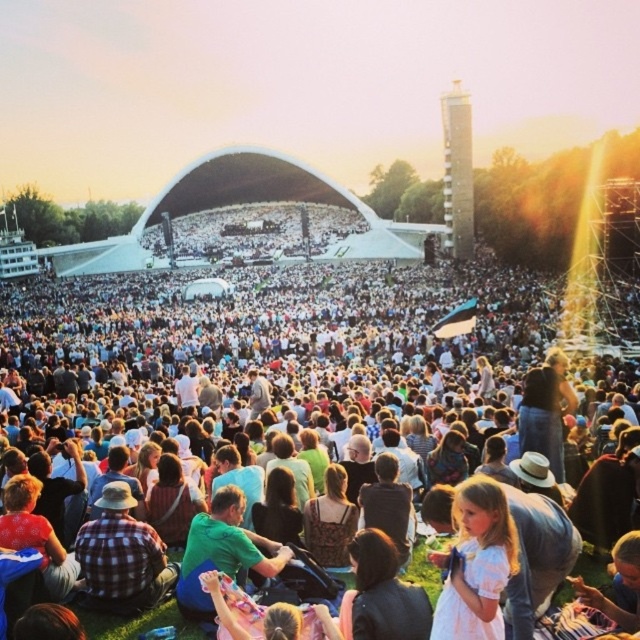
Does matte white tent at upper center have a greater height compared to denim jacket at lower right?

Correct, matte white tent at upper center is much taller as denim jacket at lower right.

Can you confirm if matte white tent at upper center is bigger than denim jacket at lower right?

Indeed, matte white tent at upper center has a larger size compared to denim jacket at lower right.

Is point (467, 269) less distant than point (570, 404)?

No, (467, 269) is behind (570, 404).

Locate an element on the screen. Image resolution: width=640 pixels, height=640 pixels. matte white tent at upper center is located at coordinates (259, 353).

Is point (83, 560) farther from viewer compared to point (572, 412)?

That is False.

Which is in front, point (115, 580) or point (552, 362)?

Point (115, 580)

Locate an element on the screen. The image size is (640, 640). plaid fabric shirt at center is located at coordinates (122, 557).

Does white cotton dress at center appear on the right side of plaid fabric shirt at center?

Yes, white cotton dress at center is to the right of plaid fabric shirt at center.

Between white cotton dress at center and plaid fabric shirt at center, which one appears on the right side from the viewer's perspective?

white cotton dress at center is more to the right.

Who is more distant from viewer, (488, 515) or (131, 500)?

The point (131, 500) is behind.

Find the location of a particular element. The width and height of the screenshot is (640, 640). white cotton dress at center is located at coordinates (476, 563).